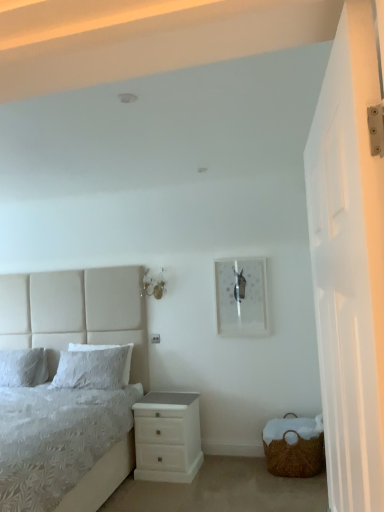
Question: Is woven brown basket at lower right bigger or smaller than white glossy chest of drawers at lower right?

Choices:
 (A) big
 (B) small

Answer: (B)

Question: From a real-world perspective, relative to white glossy chest of drawers at lower right, is woven brown basket at lower right vertically above or below?

Choices:
 (A) above
 (B) below

Answer: (B)

Question: Which object is the closest to the metallic silver picture frame at center?

Choices:
 (A) white fabric bed at left
 (B) white glossy chest of drawers at lower right
 (C) white glossy door at right
 (D) white soft pillow at left, which is the second pillow in left-to-right order
 (E) white soft pillow at left, marked as the 1th pillow in a left-to-right arrangement

Answer: (B)

Question: Estimate the real-world distances between objects in this image. Which object is farther from the white fabric bed at left?

Choices:
 (A) woven brown basket at lower right
 (B) metallic silver picture frame at center
 (C) white soft pillow at left, which is the second pillow in left-to-right order
 (D) white glossy chest of drawers at lower right
 (E) white glossy door at right

Answer: (E)